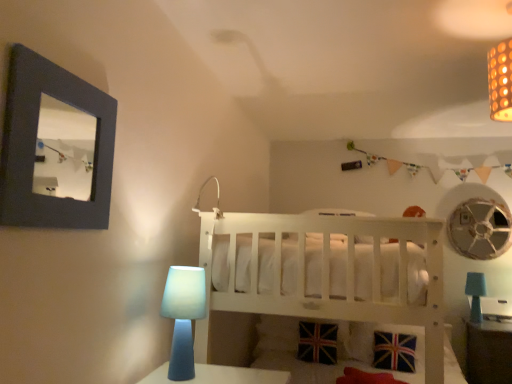
Question: In terms of width, does matte white lamp at upper center look wider or thinner when compared to white wooden crib at center?

Choices:
 (A) wide
 (B) thin

Answer: (B)

Question: In the image, is matte white lamp at upper center on the left side or the right side of white wooden crib at center?

Choices:
 (A) right
 (B) left

Answer: (B)

Question: Estimate the real-world distances between objects in this image. Which object is closer to the union jack fabric pillow at lower center?

Choices:
 (A) white wooden crib at center
 (B) blue matte table lamp at lower left, which appears as the 2th table lamp when viewed from the right
 (C) metallic silver mechanical fan at upper right
 (D) blue matte table lamp at lower right, which appears as the 1th table lamp when ordered from the bottom
 (E) matte brown table at lower right

Answer: (E)

Question: Considering the real-world distances, which object is farthest from the white wooden crib at center?

Choices:
 (A) union jack fabric pillow at lower center
 (B) metallic silver mechanical fan at upper right
 (C) blue matte table lamp at lower left, acting as the second table lamp starting from the back
 (D) dark gray matte picture frame at upper left
 (E) matte white lamp at upper center

Answer: (D)